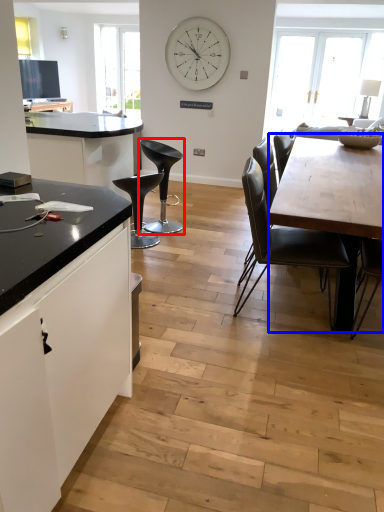
Question: Which of the following is the closest to the observer, chair (highlighted by a red box) or round table (highlighted by a blue box)?

Choices:
 (A) chair
 (B) round table

Answer: (B)